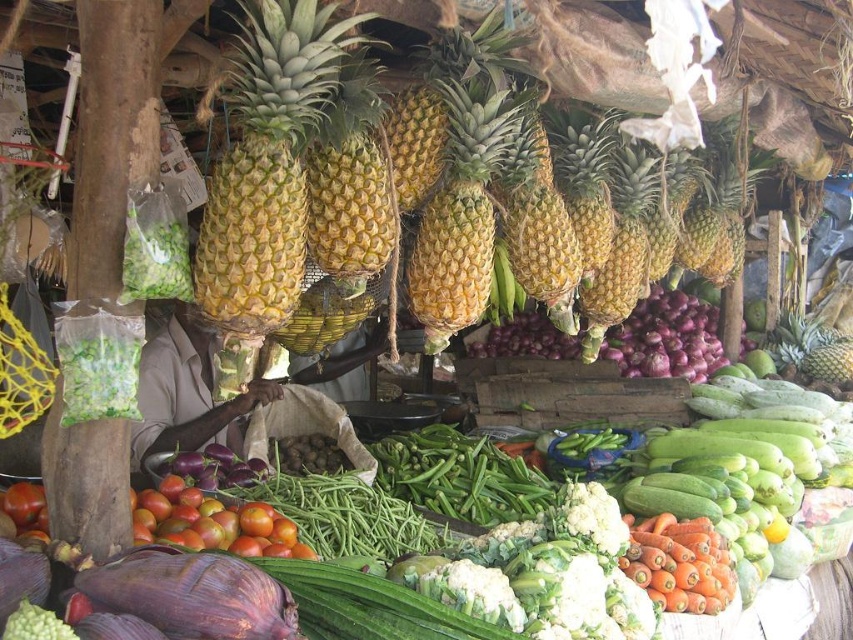
You are standing at the entrance of the market and see two points marked in the image. Which point is closer to you, point (257, 44) or point (509, 90)?

Point (257, 44) is in front of point (509, 90), so it is closer to you.